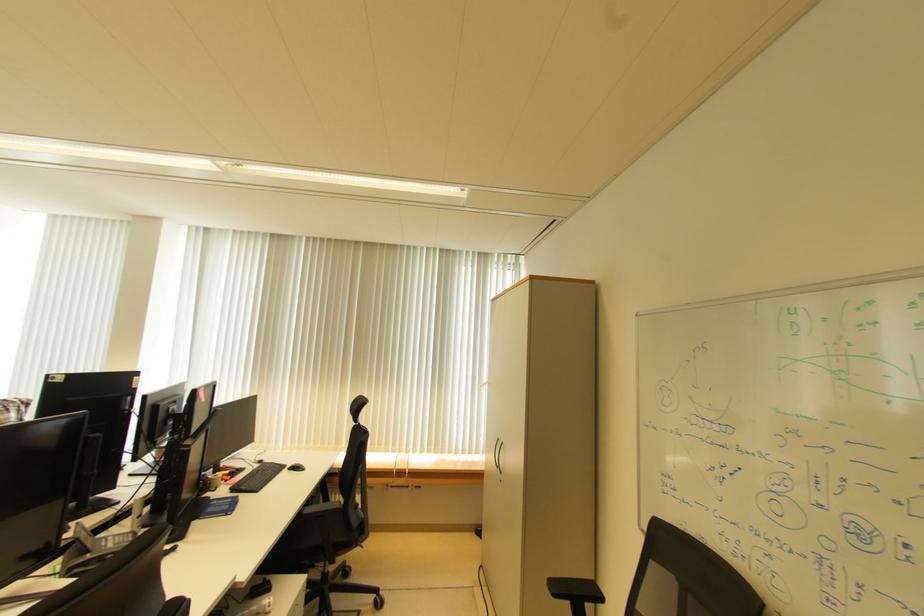
The height and width of the screenshot is (616, 924). I want to click on black computer mouse, so click(296, 467).